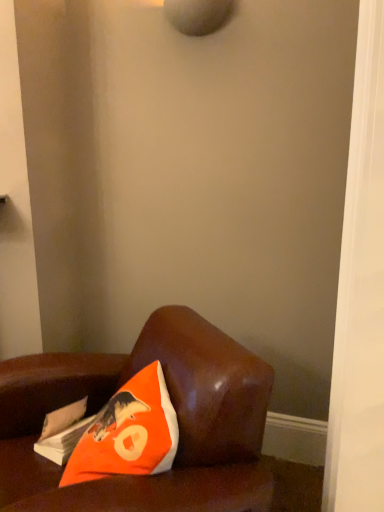
What do you see at coordinates (128, 433) in the screenshot? Image resolution: width=384 pixels, height=512 pixels. I see `orange fabric pillow at lower left` at bounding box center [128, 433].

Image resolution: width=384 pixels, height=512 pixels. Identify the location of white paper magazine at lower left. (63, 431).

Identify the location of brown leather couch at lower left. The image size is (384, 512). (177, 416).

The width and height of the screenshot is (384, 512). What do you see at coordinates (177, 416) in the screenshot?
I see `brown leather couch at lower left` at bounding box center [177, 416].

Find the location of a particular element. The width and height of the screenshot is (384, 512). orange fabric pillow at lower left is located at coordinates (128, 433).

Is point (165, 342) positioned in front of point (54, 444)?

That is False.

Is brown leather couch at lower left positioned with its back to white paper magazine at lower left?

Yes, white paper magazine at lower left is at the back of brown leather couch at lower left.

From a real-world perspective, between brown leather couch at lower left and white paper magazine at lower left, who is vertically lower?

brown leather couch at lower left.

Locate an element on the screen. Image resolution: width=384 pixels, height=512 pixels. magazine located above the brown leather couch at lower left (from a real-world perspective) is located at coordinates (63, 431).

Which is in front, point (129, 357) or point (153, 370)?

Point (153, 370)

Do you think brown leather couch at lower left is within orange fabric pillow at lower left, or outside of it?

brown leather couch at lower left cannot be found inside orange fabric pillow at lower left.

Can you see white paper magazine at lower left touching brown leather couch at lower left?

There is a gap between white paper magazine at lower left and brown leather couch at lower left.

From a real-world perspective, is white paper magazine at lower left above or below brown leather couch at lower left?

Clearly, from a real-world perspective, white paper magazine at lower left is above brown leather couch at lower left.

Which of these two, white paper magazine at lower left or brown leather couch at lower left, is wider?

brown leather couch at lower left is wider.

Based on the photo, is white paper magazine at lower left aimed at brown leather couch at lower left?

Yes.

Considering the positions of objects orange fabric pillow at lower left and white paper magazine at lower left in the image provided, who is in front, orange fabric pillow at lower left or white paper magazine at lower left?

Positioned in front is orange fabric pillow at lower left.

Between point (158, 461) and point (57, 413), which one is positioned behind?

The point (57, 413) is farther.

Would you say white paper magazine at lower left is part of orange fabric pillow at lower left's contents?

No, white paper magazine at lower left is not inside orange fabric pillow at lower left.

Can you confirm if orange fabric pillow at lower left is smaller than white paper magazine at lower left?

No, orange fabric pillow at lower left is not smaller than white paper magazine at lower left.

Is point (76, 436) closer or farther from the camera than point (127, 413)?

Point (76, 436) appears to be farther away from the viewer than point (127, 413).

Is white paper magazine at lower left at the right side of orange fabric pillow at lower left?

No.

Image resolution: width=384 pixels, height=512 pixels. Identify the location of pillow that is on the right side of white paper magazine at lower left. (128, 433).

Based on the photo, from a real-world perspective, is white paper magazine at lower left positioned under orange fabric pillow at lower left based on gravity?

Yes, from a real-world perspective, white paper magazine at lower left is beneath orange fabric pillow at lower left.

Visually, is orange fabric pillow at lower left positioned to the left or to the right of brown leather couch at lower left?

Clearly, orange fabric pillow at lower left is on the right of brown leather couch at lower left in the image.

In order to click on furniture lying below the orange fabric pillow at lower left (from the image's perspective) in this screenshot , I will do `click(177, 416)`.

In terms of width, does orange fabric pillow at lower left look wider or thinner when compared to brown leather couch at lower left?

In the image, orange fabric pillow at lower left appears to be more narrow than brown leather couch at lower left.

Looking at this image, from the image's perspective, is orange fabric pillow at lower left positioned above or below brown leather couch at lower left?

From the image's perspective, orange fabric pillow at lower left appears above brown leather couch at lower left.

Where is `magazine located above the brown leather couch at lower left (from the image's perspective)`? The height and width of the screenshot is (512, 384). magazine located above the brown leather couch at lower left (from the image's perspective) is located at coordinates (63, 431).

Where is `furniture on the left of orange fabric pillow at lower left`? The image size is (384, 512). furniture on the left of orange fabric pillow at lower left is located at coordinates (177, 416).

Estimate the real-world distances between objects in this image. Which object is further from white paper magazine at lower left, orange fabric pillow at lower left or brown leather couch at lower left?

brown leather couch at lower left lies further to white paper magazine at lower left than the other object.

Based on their spatial positions, is brown leather couch at lower left or orange fabric pillow at lower left closer to white paper magazine at lower left?

Based on the image, orange fabric pillow at lower left appears to be nearer to white paper magazine at lower left.

When comparing their distances from orange fabric pillow at lower left, does brown leather couch at lower left or white paper magazine at lower left seem closer?

brown leather couch at lower left is closer to orange fabric pillow at lower left.

Looking at the image, which one is located further to orange fabric pillow at lower left, white paper magazine at lower left or brown leather couch at lower left?

white paper magazine at lower left lies further to orange fabric pillow at lower left than the other object.

Which object lies nearer to the anchor point brown leather couch at lower left, white paper magazine at lower left or orange fabric pillow at lower left?

orange fabric pillow at lower left is closer to brown leather couch at lower left.

From the image, which object appears to be farther from brown leather couch at lower left, orange fabric pillow at lower left or white paper magazine at lower left?

white paper magazine at lower left lies further to brown leather couch at lower left than the other object.

This screenshot has height=512, width=384. What are the coordinates of `pillow positioned between brown leather couch at lower left and white paper magazine at lower left from near to far` in the screenshot? It's located at (128, 433).